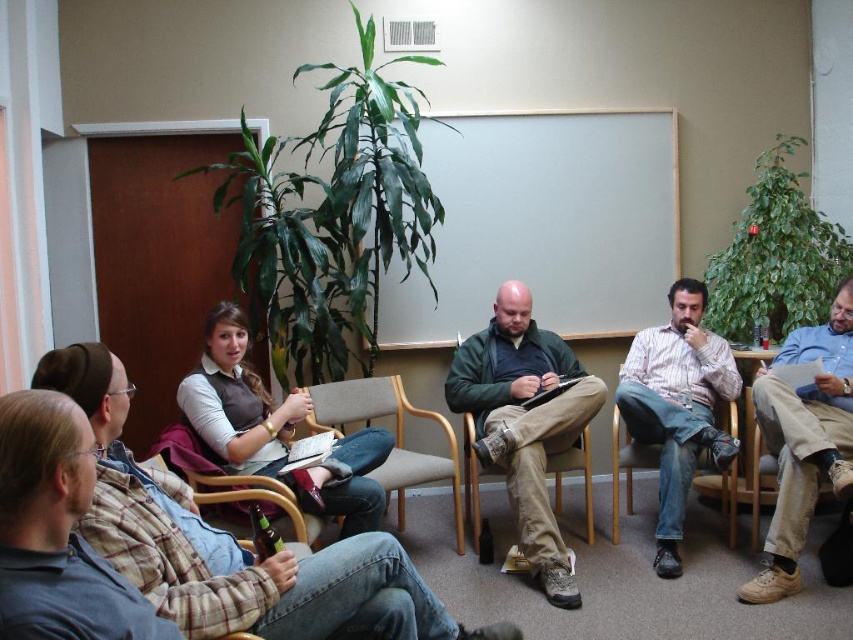
Question: Does white striped shirt at center appear under light brown wood armchair at center?

Choices:
 (A) no
 (B) yes

Answer: (A)

Question: Is tan canvas pants at center to the right of white striped shirt at center from the viewer's perspective?

Choices:
 (A) yes
 (B) no

Answer: (A)

Question: Which point is closer to the camera?

Choices:
 (A) (59, 524)
 (B) (550, 512)

Answer: (A)

Question: Which object is closer to the camera taking this photo?

Choices:
 (A) green matte jacket at center
 (B) tan canvas pants at center

Answer: (B)

Question: Observing the image, what is the correct spatial positioning of gray flannel shirt at left in reference to tan canvas pants at center?

Choices:
 (A) right
 (B) left

Answer: (B)

Question: Estimate the real-world distances between objects in this image. Which object is closer to the plaid flannel shirt at center?

Choices:
 (A) light brown wood armchair at center
 (B) tan fabric chair at center
 (C) white striped shirt at center
 (D) tan canvas pants at center

Answer: (A)